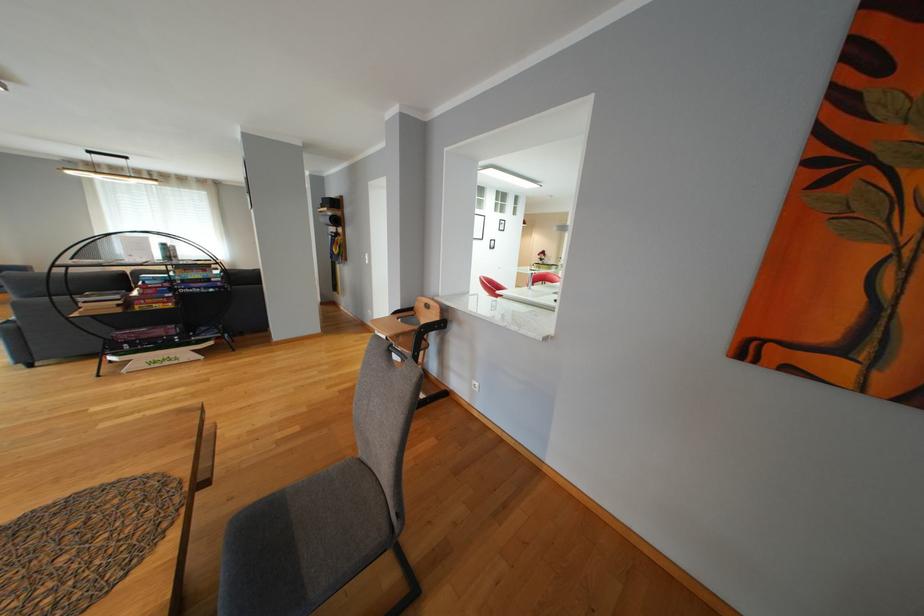
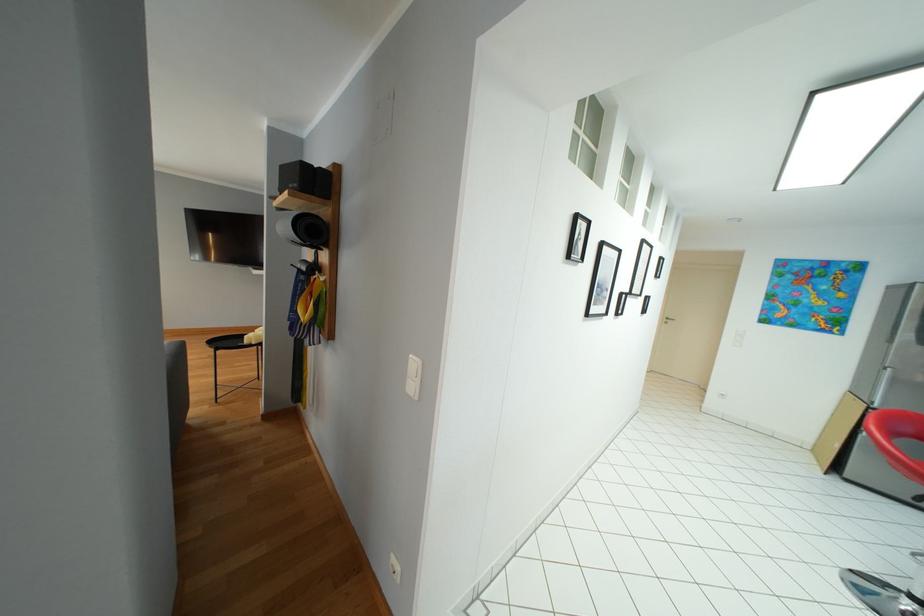
Which direction would the cameraman need to move to produce the second image?

The cameraman walked toward left, forward.